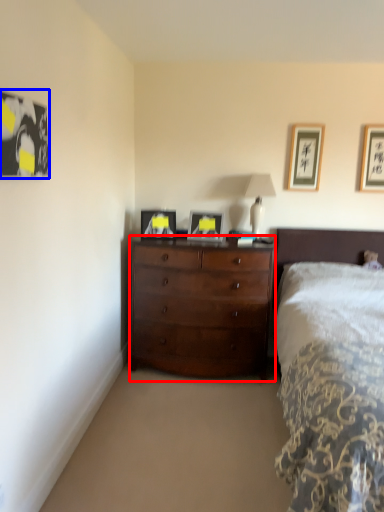
Question: Which point is closer to the camera, chest of drawers (highlighted by a red box) or picture frame (highlighted by a blue box)?

Choices:
 (A) chest of drawers
 (B) picture frame

Answer: (B)